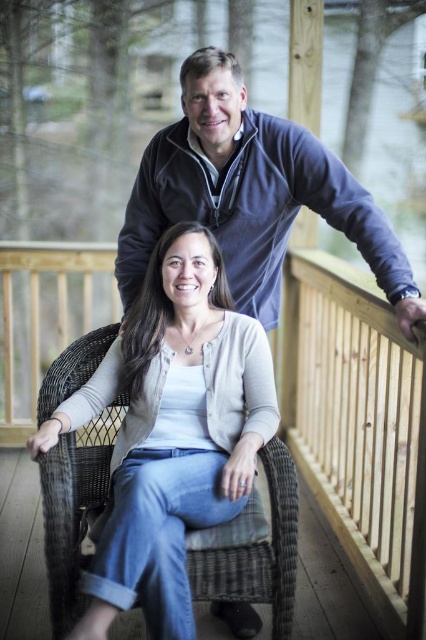
Who is more distant from viewer, [333,422] or [163,150]?

Point [333,422]

In the scene shown: Can you confirm if light wood railing at upper right is positioned to the left of blue fleece sweater at upper center?

In fact, light wood railing at upper right is to the right of blue fleece sweater at upper center.

Which is behind, point (379, 452) or point (209, 144)?

The point (379, 452) is more distant.

The height and width of the screenshot is (640, 426). In order to click on light wood railing at upper right in this screenshot , I will do `click(356, 422)`.

Is the position of matte gray cardigan at center more distant than that of blue fleece sweater at upper center?

No.

Does matte gray cardigan at center have a greater height compared to blue fleece sweater at upper center?

Correct, matte gray cardigan at center is much taller as blue fleece sweater at upper center.

Which is behind, point (112, 572) or point (287, 156)?

The point (287, 156) is behind.

Where is `matte gray cardigan at center`? matte gray cardigan at center is located at coordinates (172, 432).

Is matte gray cardigan at center closer to the viewer compared to light wood railing at upper right?

That is True.

Between point (221, 468) and point (307, 445), which one is positioned in front?

Point (221, 468) is more forward.

Between point (178, 384) and point (317, 472), which one is positioned in front?

Point (178, 384) is more forward.

Identify the location of matte gray cardigan at center. (172, 432).